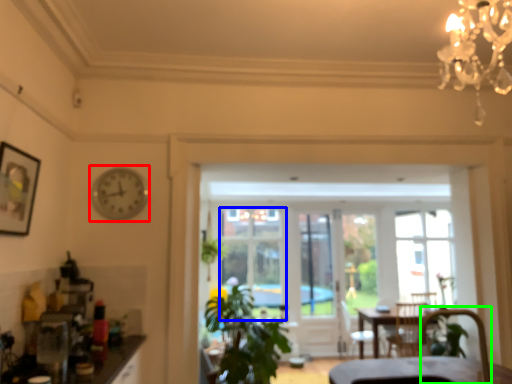
Question: Based on their relative distances, which object is nearer to clock (highlighted by a red box)? Choose from window (highlighted by a blue box) and armchair (highlighted by a green box).

Choices:
 (A) window
 (B) armchair

Answer: (B)